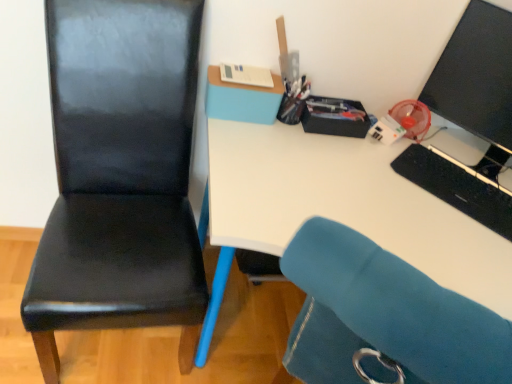
Question: Is point (497, 150) closer or farther from the camera than point (318, 122)?

Choices:
 (A) farther
 (B) closer

Answer: (A)

Question: Looking at their shapes, would you say black glossy monitor at upper right is wider or thinner than matte black stationery box at upper right, the third stationery from the left?

Choices:
 (A) wide
 (B) thin

Answer: (A)

Question: Estimate the real-world distances between objects in this image. Which object is farther from the black leather chair at left?

Choices:
 (A) white paper at upper center, the 3th stationery from the right
 (B) black matte keyboard at right
 (C) matte black stationery box at upper right, the third stationery from the left
 (D) white glossy desk at upper center
 (E) black glossy monitor at upper right

Answer: (E)

Question: Considering the real-world distances, which object is farthest from the white glossy desk at upper center?

Choices:
 (A) black leather chair at left
 (B) white paper at upper center, the 1th stationery viewed from the left
 (C) matte black stationery box at upper right, which is the first stationery in right-to-left order
 (D) black glossy monitor at upper right
 (E) metallic pen holder at upper center, which appears as the 2th stationery when viewed from the left

Answer: (D)